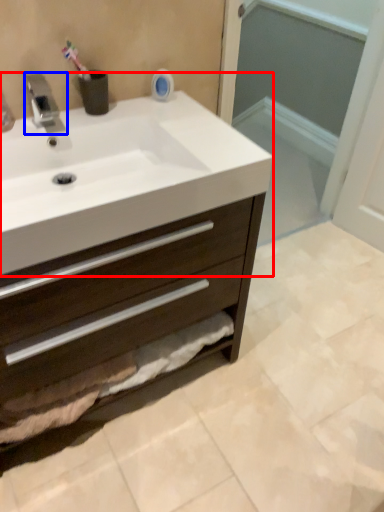
Question: Among these objects, which one is nearest to the camera, sink (highlighted by a red box) or tap (highlighted by a blue box)?

Choices:
 (A) sink
 (B) tap

Answer: (A)